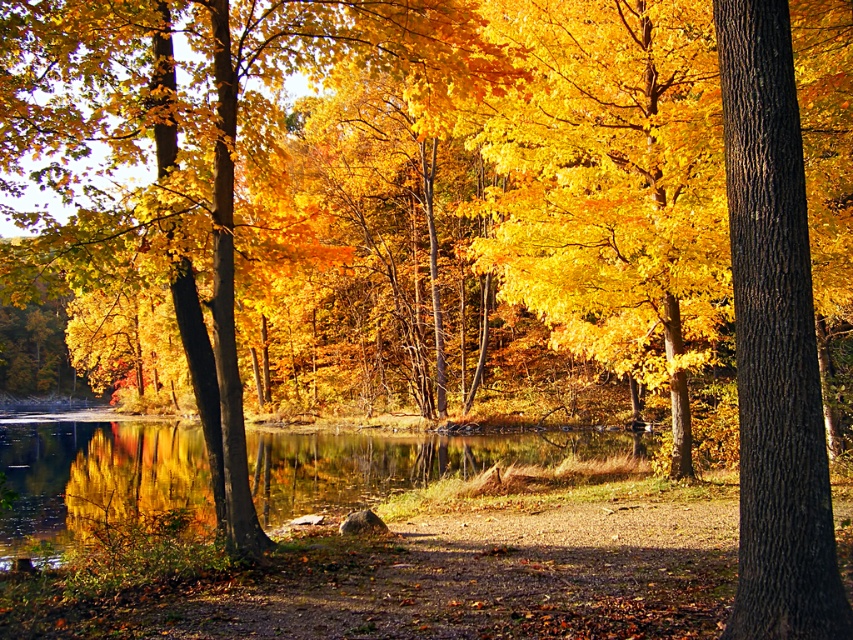
Is point (750, 381) behind point (77, 445)?

No, it is not.

Between brown rough bark tree at right and glossy reflective water at center, which one appears on the left side from the viewer's perspective?

Positioned to the left is glossy reflective water at center.

Does point (759, 116) come behind point (77, 480)?

No, (759, 116) is in front of (77, 480).

What are the coordinates of `brown rough bark tree at right` in the screenshot? It's located at (775, 340).